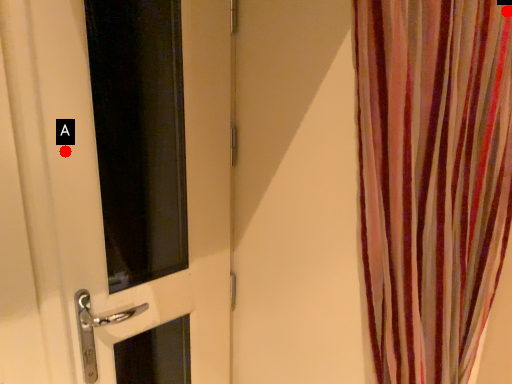
Question: Two points are circled on the image, labeled by A and B beside each circle. Which point is closer to the camera?

Choices:
 (A) A is closer
 (B) B is closer

Answer: (B)